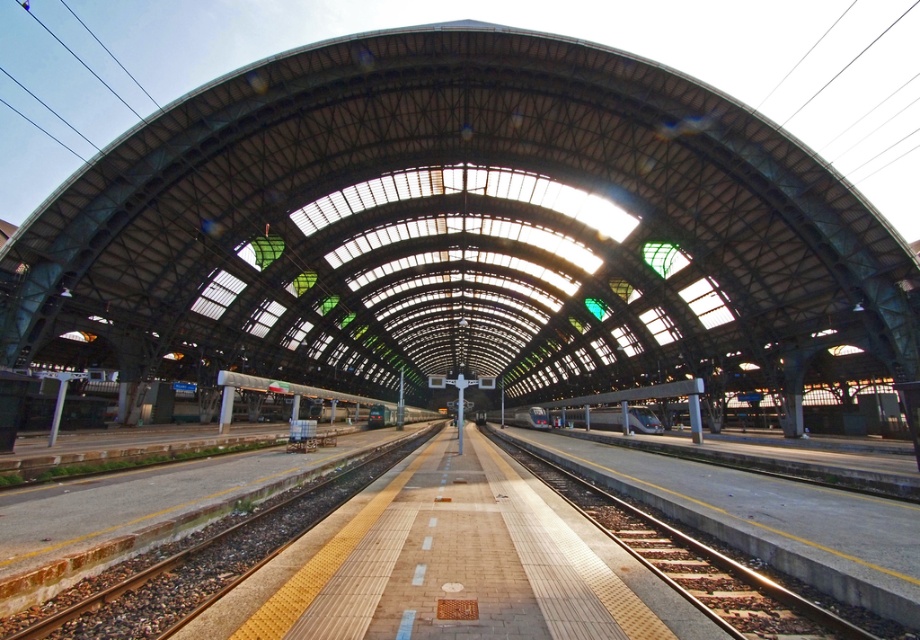
Question: Which is farther from the silver metallic train at center?

Choices:
 (A) green metallic train at center
 (B) brown gravel train track at center
 (C) smooth concrete train track at center

Answer: (B)

Question: Which point is closer to the camera?

Choices:
 (A) (648, 426)
 (B) (263, 385)
 (C) (748, 600)

Answer: (C)

Question: Is brown gravel train track at center below silver metallic train at center?

Choices:
 (A) yes
 (B) no

Answer: (B)

Question: Which point is closer to the camera?

Choices:
 (A) (634, 410)
 (B) (210, 589)
 (C) (332, 396)

Answer: (B)

Question: Does brown gravel train track at center lie in front of silver metallic train at center?

Choices:
 (A) yes
 (B) no

Answer: (A)

Question: Is brown gravel train track at center bigger than smooth concrete train track at center?

Choices:
 (A) yes
 (B) no

Answer: (B)